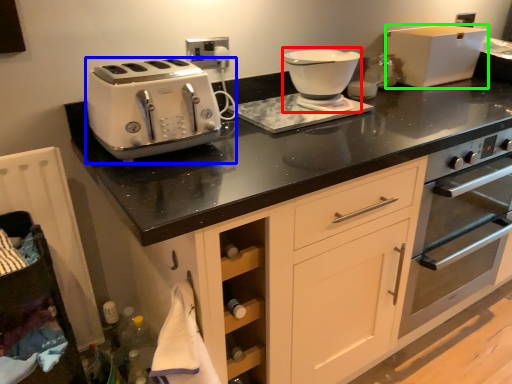
Question: Estimate the real-world distances between objects in this image. Which object is closer to food processor (highlighted by a red box), toaster (highlighted by a blue box) or kitchen appliance (highlighted by a green box)?

Choices:
 (A) toaster
 (B) kitchen appliance

Answer: (A)